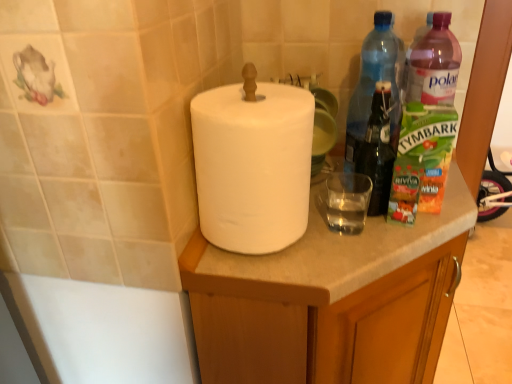
The height and width of the screenshot is (384, 512). Find the location of `free spot to the left of pink plastic bottle at right, arranged as the first bottle when viewed from the right`. free spot to the left of pink plastic bottle at right, arranged as the first bottle when viewed from the right is located at coordinates (338, 190).